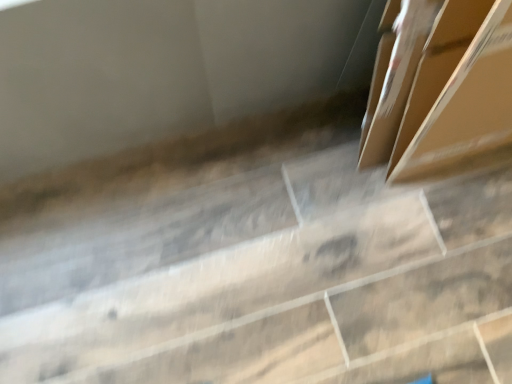
Question: Is brown cardboard box at center wider or thinner than transparent plastic concrete at center?

Choices:
 (A) thin
 (B) wide

Answer: (A)

Question: Does point (444, 26) appear closer or farther from the camera than point (420, 279)?

Choices:
 (A) farther
 (B) closer

Answer: (B)

Question: Relative to transparent plastic concrete at center, is brown cardboard box at center in front or behind?

Choices:
 (A) behind
 (B) front

Answer: (B)

Question: Is transparent plastic concrete at center in front of or behind brown cardboard box at center in the image?

Choices:
 (A) behind
 (B) front

Answer: (A)

Question: Is transparent plastic concrete at center spatially inside brown cardboard box at center, or outside of it?

Choices:
 (A) outside
 (B) inside

Answer: (A)

Question: Based on their positions, is transparent plastic concrete at center located to the left or right of brown cardboard box at center?

Choices:
 (A) right
 (B) left

Answer: (B)

Question: Is point [x=452, y=185] positioned closer to the camera than point [x=455, y=147]?

Choices:
 (A) farther
 (B) closer

Answer: (A)